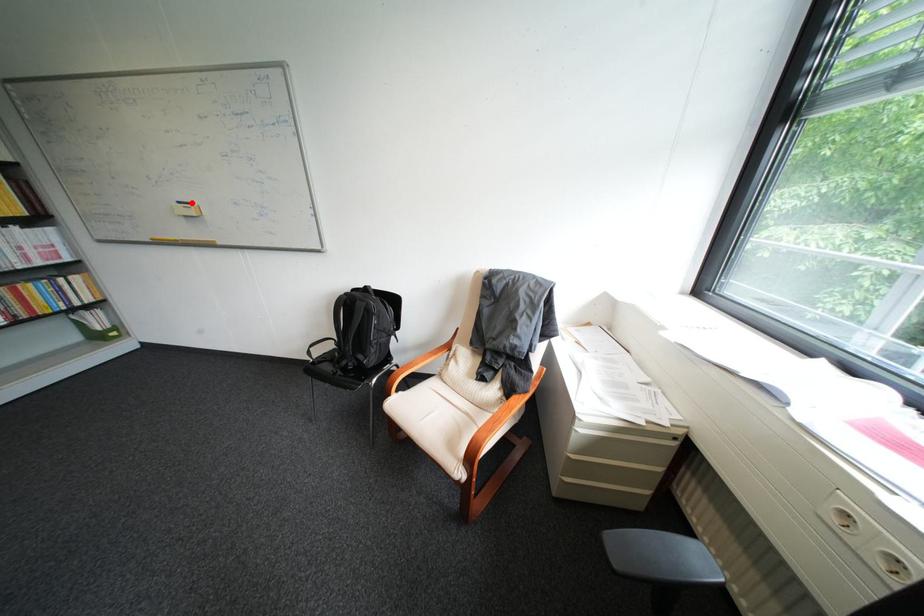
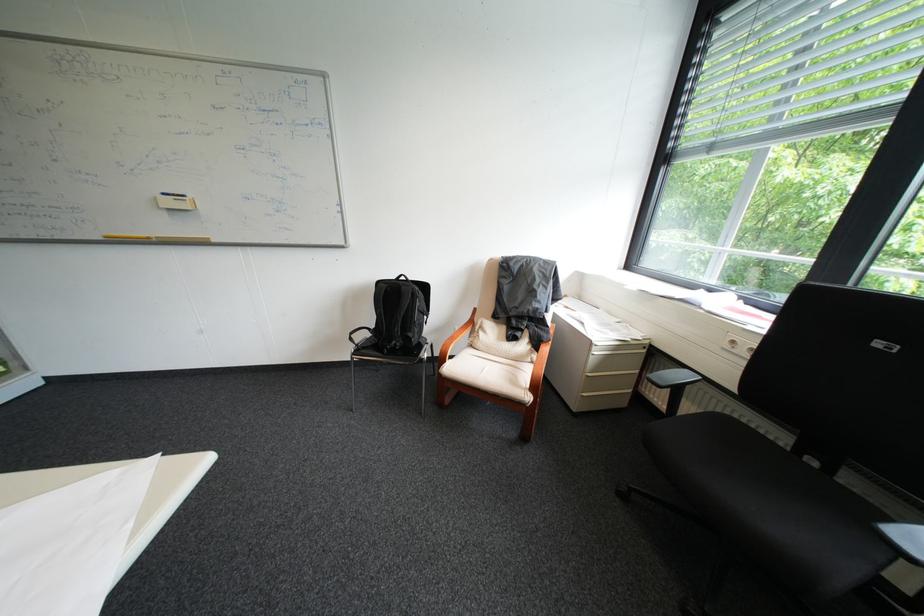
In the second image, find the point that corresponds to the highlighted location in the first image.

(176, 195)